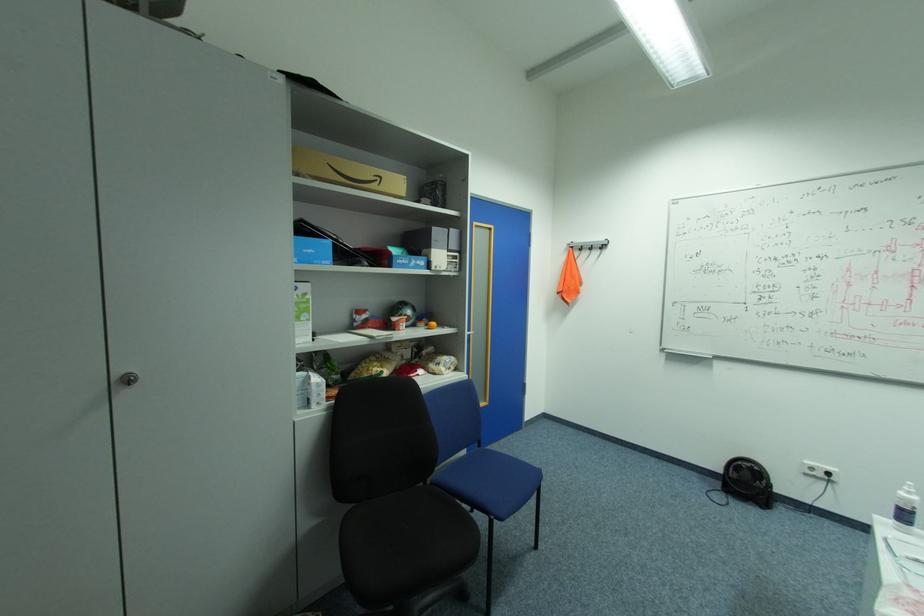
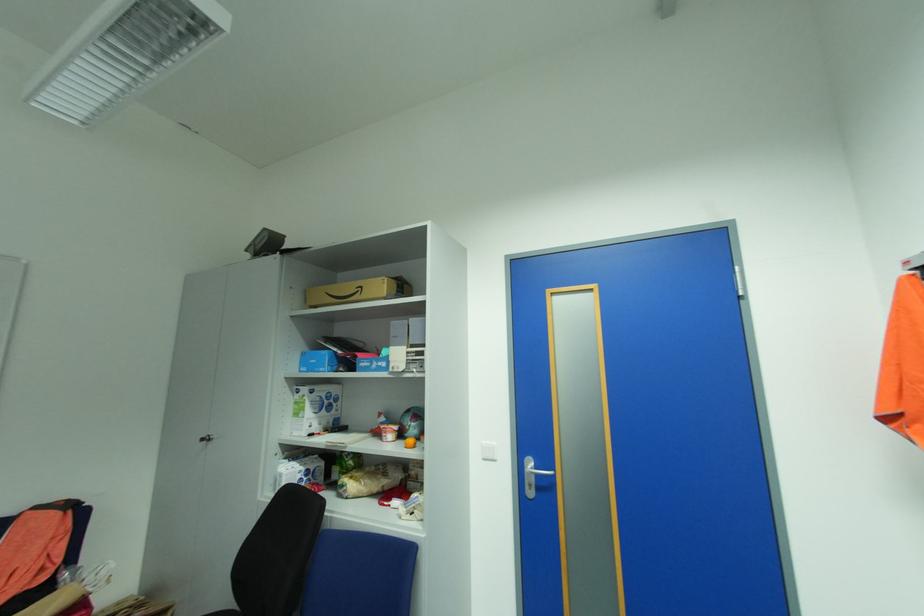
Locate, in the second image, the point that corresponds to (x=137, y=379) in the first image.

(213, 439)